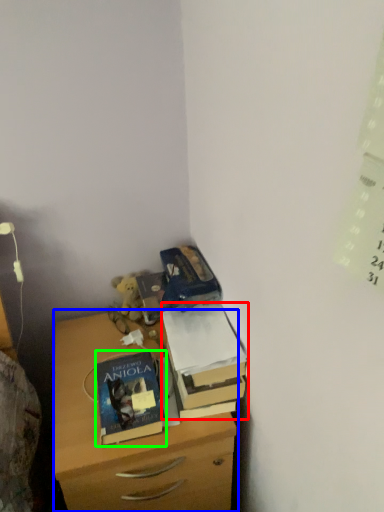
Question: Which object is positioned closest to box (highlighted by a red box)? Select from chest of drawers (highlighted by a blue box) and book (highlighted by a green box).

Choices:
 (A) chest of drawers
 (B) book

Answer: (B)